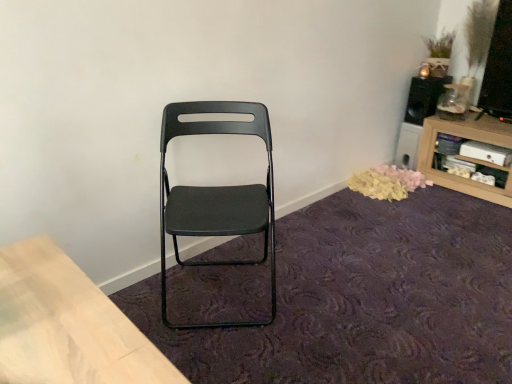
Image resolution: width=512 pixels, height=384 pixels. I want to click on unoccupied area in front of yellow fabric petals at lower right, so click(x=412, y=211).